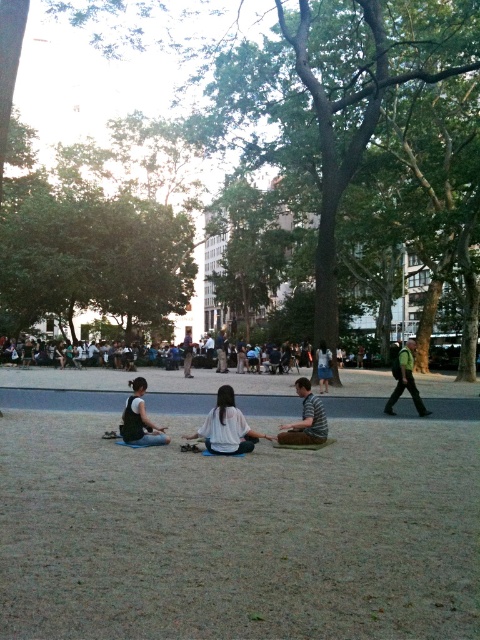
You are a photographer trying to capture the denim pants at center and the light brown wooden bench at center in a single shot. Based on their positions, can you determine which object is closer to the camera?

The denim pants at center is below the light brown wooden bench at center, which means it is closer to the camera.

You are a photographer standing at the edge of the park, and you want to take a photo of the denim pants at center and the light brown wooden bench at center. If your camera has a maximum zoom range of 10 meters, can you capture both objects in a single frame without moving?

The denim pants at center is 8.74 meters from the light brown wooden bench at center. Since the maximum zoom range is 10 meters, the distance between them is within the camera capability, so yes, you can capture both objects in a single frame without moving.

What is located at the coordinates point (324, 365) in the park scene?

The point (324, 365) corresponds to denim pants at center.